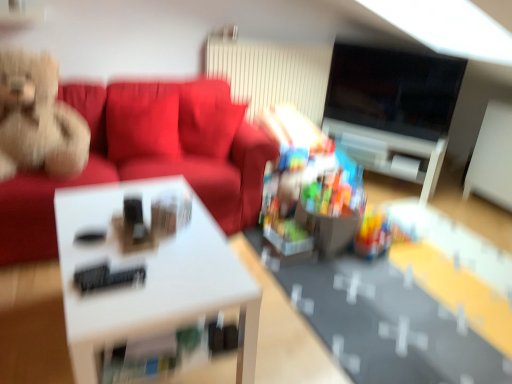
What do you see at coordinates (146, 270) in the screenshot?
I see `white glossy table at center` at bounding box center [146, 270].

You are a GUI agent. You are given a task and a screenshot of the screen. Output one action in this format:
    pyautogui.click(x=<x>, y=<y>)
    Task: Click on the white glossy table at center
    Image resolution: width=512 pixels, height=384 pixels.
    Given the screenshot: What is the action you would take?
    (146, 270)

The image size is (512, 384). What do you see at coordinates (373, 235) in the screenshot? I see `translucent plastic toy at center, which is counted as the first toy, starting from the bottom` at bounding box center [373, 235].

This screenshot has width=512, height=384. I want to click on suede-like red couch at upper left, so click(x=148, y=157).

Is the position of white glossy table at center more distant than that of translucent plastic toy at center, the 2th toy from the left?

That is False.

Find the location of a particular element. The height and width of the screenshot is (384, 512). table above the translucent plastic toy at center, the second toy in the top-to-bottom sequence (from a real-world perspective) is located at coordinates (146, 270).

Is white glossy table at center placed right next to translucent plastic toy at center, the 2th toy from the left?

No, white glossy table at center is not beside translucent plastic toy at center, the 2th toy from the left.

From a real-world perspective, is white glossy table at center on translucent plastic toy at center, the 2th toy from the left?

Yes, from a real-world perspective, white glossy table at center is on top of translucent plastic toy at center, the 2th toy from the left.

Which object is closer to the camera taking this photo, fluffy beige teddy bear on the left, which appears as the second toy when ordered from the bottom, or white glossy table at center?

white glossy table at center is in front.

Is fluffy beige teddy bear on the left, the first toy from the top, positioned far away from white glossy table at center?

fluffy beige teddy bear on the left, the first toy from the top, is actually quite close to white glossy table at center.

In order to click on the 2nd toy above the white glossy table at center (from the image's perspective) in this screenshot , I will do `click(38, 119)`.

Which is behind, point (31, 58) or point (128, 265)?

The point (31, 58) is farther.

From a real-world perspective, which is physically above, fluffy beige teddy bear on the left, the 2th toy viewed from the right, or suede-like red couch at upper left?

fluffy beige teddy bear on the left, the 2th toy viewed from the right, is physically above.

Which is closer to the camera, (42, 62) or (163, 143)?

The point (42, 62) is closer.

Is fluffy beige teddy bear on the left, which appears as the second toy when ordered from the bottom, spatially inside black glossy tv at upper right, or outside of it?

fluffy beige teddy bear on the left, which appears as the second toy when ordered from the bottom, exists outside the volume of black glossy tv at upper right.

How much distance is there between fluffy beige teddy bear on the left, which appears as the second toy when ordered from the bottom, and black glossy tv at upper right?

They are 6.97 feet apart.

Is fluffy beige teddy bear on the left, placed as the 1th toy when sorted from left to right, in contact with black glossy tv at upper right?

No, fluffy beige teddy bear on the left, placed as the 1th toy when sorted from left to right, is not with black glossy tv at upper right.

What's the angular difference between fluffy beige teddy bear on the left, placed as the 1th toy when sorted from left to right, and translucent plastic toy at center, the second toy in the top-to-bottom sequence,'s facing directions?

There is a 18.6-degree angle between the facing directions of fluffy beige teddy bear on the left, placed as the 1th toy when sorted from left to right, and translucent plastic toy at center, the second toy in the top-to-bottom sequence.

Could you measure the distance between fluffy beige teddy bear on the left, the first toy from the top, and translucent plastic toy at center, which is counted as the first toy, starting from the bottom?

fluffy beige teddy bear on the left, the first toy from the top, and translucent plastic toy at center, which is counted as the first toy, starting from the bottom, are 1.75 meters apart.

Is translucent plastic toy at center, which is counted as the first toy, starting from the bottom, at the back of fluffy beige teddy bear on the left, which appears as the second toy when ordered from the bottom?

fluffy beige teddy bear on the left, which appears as the second toy when ordered from the bottom, does not have its back to translucent plastic toy at center, which is counted as the first toy, starting from the bottom.

Is point (9, 99) positioned before point (382, 238)?

That is True.

Is white glossy table at center to the left of fluffy beige teddy bear on the left, the 2th toy viewed from the right, from the viewer's perspective?

Incorrect, white glossy table at center is not on the left side of fluffy beige teddy bear on the left, the 2th toy viewed from the right.

Who is bigger, white glossy table at center or fluffy beige teddy bear on the left, the first toy from the top?

Bigger between the two is white glossy table at center.

Identify the location of table that appears in front of the fluffy beige teddy bear on the left, the 2th toy viewed from the right. The height and width of the screenshot is (384, 512). (146, 270).

From a real-world perspective, is black glossy tv at upper right located beneath translucent plastic toy at center, the 2th toy from the left?

No, from a real-world perspective, black glossy tv at upper right is not beneath translucent plastic toy at center, the 2th toy from the left.

Would you consider black glossy tv at upper right to be distant from translucent plastic toy at center, the second toy in the top-to-bottom sequence?

Yes.

Is black glossy tv at upper right in front of or behind translucent plastic toy at center, the 2th toy from the left, in the image?

black glossy tv at upper right is positioned farther from the viewer than translucent plastic toy at center, the 2th toy from the left.

Which of these two, black glossy tv at upper right or translucent plastic toy at center, the second toy in the top-to-bottom sequence, is thinner?

With smaller width is black glossy tv at upper right.

The height and width of the screenshot is (384, 512). Find the location of `toy below the white glossy table at center (from a real-world perspective)`. toy below the white glossy table at center (from a real-world perspective) is located at coordinates (373, 235).

Locate an element on the screen. This screenshot has height=384, width=512. toy positioned vertically above the white glossy table at center (from a real-world perspective) is located at coordinates (38, 119).

Which object lies further to the anchor point black glossy tv at upper right, suede-like red couch at upper left or fluffy beige teddy bear on the left, the first toy from the top?

fluffy beige teddy bear on the left, the first toy from the top, lies further to black glossy tv at upper right than the other object.

Considering their positions, is suede-like red couch at upper left positioned further to white glossy table at center than black glossy tv at upper right?

Among the two, black glossy tv at upper right is located further to white glossy table at center.

From the picture: Estimate the real-world distances between objects in this image. Which object is further from suede-like red couch at upper left, fluffy beige teddy bear on the left, the first toy from the top, or translucent plastic toy at center, which is counted as the first toy, starting from the bottom?

translucent plastic toy at center, which is counted as the first toy, starting from the bottom, is further to suede-like red couch at upper left.

Consider the image. From the image, which object appears to be farther from white glossy table at center, suede-like red couch at upper left or translucent plastic toy at center, the 2th toy from the left?

The object further to white glossy table at center is translucent plastic toy at center, the 2th toy from the left.

Estimate the real-world distances between objects in this image. Which object is further from black glossy tv at upper right, white glossy table at center or suede-like red couch at upper left?

white glossy table at center is positioned further to the anchor black glossy tv at upper right.

When comparing their distances from suede-like red couch at upper left, does white glossy table at center or fluffy beige teddy bear on the left, which appears as the second toy when ordered from the bottom, seem closer?

fluffy beige teddy bear on the left, which appears as the second toy when ordered from the bottom, is closer to suede-like red couch at upper left.

Considering their positions, is suede-like red couch at upper left positioned further to white glossy table at center than fluffy beige teddy bear on the left, the 2th toy viewed from the right?

fluffy beige teddy bear on the left, the 2th toy viewed from the right.

From the image, which object appears to be nearer to fluffy beige teddy bear on the left, placed as the 1th toy when sorted from left to right, suede-like red couch at upper left or black glossy tv at upper right?

Based on the image, suede-like red couch at upper left appears to be nearer to fluffy beige teddy bear on the left, placed as the 1th toy when sorted from left to right.

Where is `table between fluffy beige teddy bear on the left, which appears as the second toy when ordered from the bottom, and translucent plastic toy at center, arranged as the 1th toy when viewed from the right`? table between fluffy beige teddy bear on the left, which appears as the second toy when ordered from the bottom, and translucent plastic toy at center, arranged as the 1th toy when viewed from the right is located at coordinates (146, 270).

Locate an element on the screen. The height and width of the screenshot is (384, 512). studio couch between fluffy beige teddy bear on the left, the first toy from the top, and white glossy table at center from top to bottom is located at coordinates (148, 157).

The height and width of the screenshot is (384, 512). I want to click on table located between suede-like red couch at upper left and translucent plastic toy at center, the 2th toy from the left, in the left-right direction, so click(x=146, y=270).

Where is `toy between fluffy beige teddy bear on the left, placed as the 1th toy when sorted from left to right, and black glossy tv at upper right, in the horizontal direction`? toy between fluffy beige teddy bear on the left, placed as the 1th toy when sorted from left to right, and black glossy tv at upper right, in the horizontal direction is located at coordinates (373, 235).